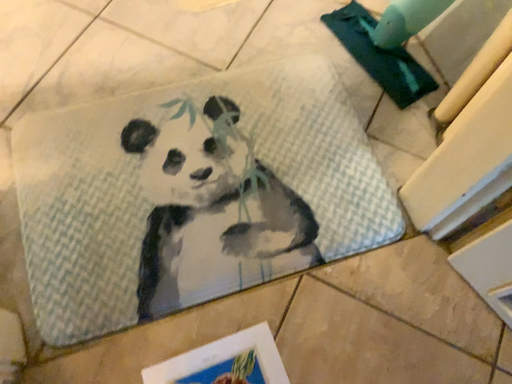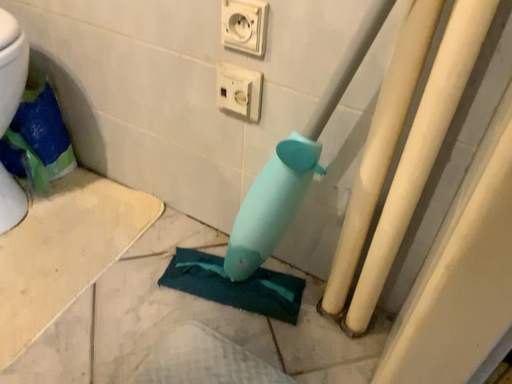
Question: How did the camera likely rotate when shooting the video?

Choices:
 (A) rotated downward
 (B) rotated upward

Answer: (B)